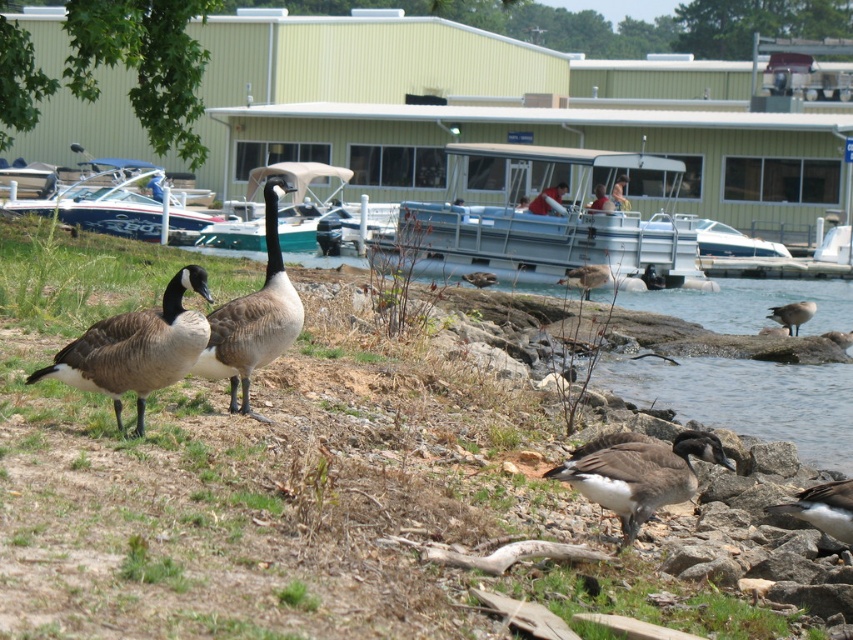
Question: Does brown feathered goose at lower left appear over smooth leather jacket at center?

Choices:
 (A) no
 (B) yes

Answer: (A)

Question: Is brown matte goose at center to the left of smooth leather jacket at center from the viewer's perspective?

Choices:
 (A) no
 (B) yes

Answer: (B)

Question: Which object appears farthest from the camera in this image?

Choices:
 (A) dark brown feathers at lower right
 (B) brown matte duck at center

Answer: (B)

Question: Is dark brown feathers at lower right below brown feathered duck at lower right?

Choices:
 (A) no
 (B) yes

Answer: (B)

Question: Which of the following is the farthest from the observer?

Choices:
 (A) smooth leather jacket at center
 (B) dark brown feathers at lower right

Answer: (A)

Question: Which point is farther from the camera taking this photo?

Choices:
 (A) (689, 221)
 (B) (590, 460)
 (C) (215, 337)

Answer: (A)